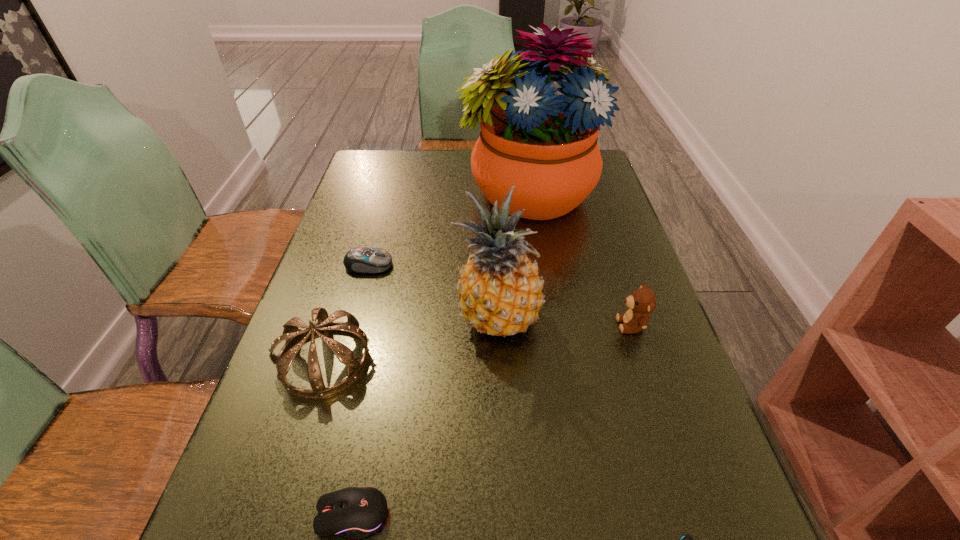
Where is `flower arrangement`? The width and height of the screenshot is (960, 540). flower arrangement is located at coordinates (545, 144).

In order to click on the tallest object in this screenshot , I will do `click(545, 144)`.

Find the location of `pineapple`. pineapple is located at coordinates (500, 292).

Where is `the fifth shortest object`? This screenshot has width=960, height=540. the fifth shortest object is located at coordinates (292, 334).

The width and height of the screenshot is (960, 540). I want to click on the fourth shortest object, so click(642, 302).

At what (x,y) coordinates should I click in order to perform the action: click on the second farthest object. Please return your answer as a coordinate pair (x, y). The height and width of the screenshot is (540, 960). Looking at the image, I should click on (366, 260).

I want to click on vacant space located on the left of the tallest object, so click(417, 194).

Locate an element on the screen. This screenshot has height=540, width=960. free space located on the back of the sixth shortest object is located at coordinates (492, 214).

I want to click on vacant point located 0.390m on the back of the tiara, so click(370, 219).

Identify the location of vacant space situated 0.260m on the face of the fourth tallest object. (495, 325).